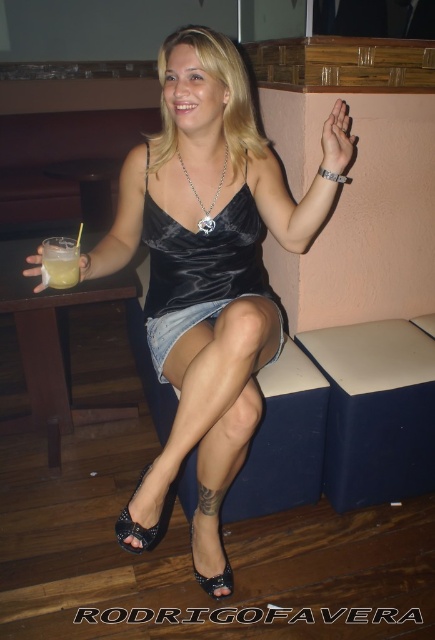
Question: Does satin dress at center appear over black satin sandal at lower center?

Choices:
 (A) no
 (B) yes

Answer: (B)

Question: Can you confirm if black leather sandal at lower left is bigger than black satin sandal at lower center?

Choices:
 (A) yes
 (B) no

Answer: (A)

Question: Which point is closer to the camera?

Choices:
 (A) denim shorts at center
 (B) black satin sandal at lower center
 (C) satin dress at center

Answer: (A)

Question: Can you confirm if satin black dress at center is thinner than denim shorts at center?

Choices:
 (A) no
 (B) yes

Answer: (A)

Question: Which is nearer to the satin dress at center?

Choices:
 (A) silver metallic pendant at center
 (B) black leather sandal at lower left
 (C) translucent glass drink at lower left
 (D) black satin sandal at lower center

Answer: (A)

Question: Which of these objects is positioned farthest from the translucent glass drink at lower left?

Choices:
 (A) black satin sandal at lower center
 (B) black leather sandal at lower left
 (C) satin dress at center

Answer: (A)